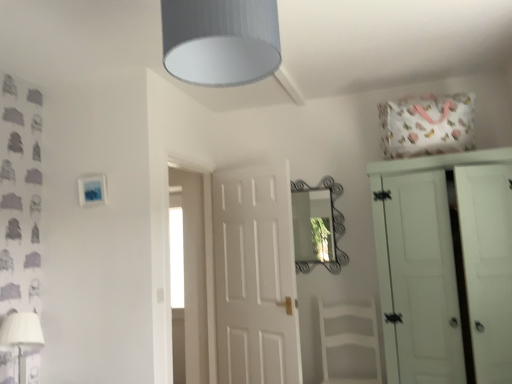
Question: Is white fabric lampshade at lower left a part of white painted wood wardrobe at right?

Choices:
 (A) no
 (B) yes

Answer: (A)

Question: From a real-world perspective, is white painted wood wardrobe at right located higher than white fabric lampshade at lower left?

Choices:
 (A) no
 (B) yes

Answer: (B)

Question: Can you confirm if white painted wood wardrobe at right is taller than white fabric lampshade at lower left?

Choices:
 (A) yes
 (B) no

Answer: (A)

Question: Considering the relative sizes of white painted wood wardrobe at right and white fabric lampshade at lower left in the image provided, is white painted wood wardrobe at right thinner than white fabric lampshade at lower left?

Choices:
 (A) no
 (B) yes

Answer: (A)

Question: Can you confirm if white painted wood wardrobe at right is smaller than white fabric lampshade at lower left?

Choices:
 (A) yes
 (B) no

Answer: (B)

Question: From a real-world perspective, is white painted wood wardrobe at right beneath white fabric lampshade at lower left?

Choices:
 (A) no
 (B) yes

Answer: (A)

Question: Is white painted wood wardrobe at right outside of white wood armchair at center?

Choices:
 (A) no
 (B) yes

Answer: (B)

Question: Is white painted wood wardrobe at right taller than white wood armchair at center?

Choices:
 (A) yes
 (B) no

Answer: (A)

Question: Is white painted wood wardrobe at right in contact with white wood armchair at center?

Choices:
 (A) yes
 (B) no

Answer: (B)

Question: Is white painted wood wardrobe at right behind white wood armchair at center?

Choices:
 (A) yes
 (B) no

Answer: (B)

Question: Can you confirm if white painted wood wardrobe at right is wider than white wood armchair at center?

Choices:
 (A) yes
 (B) no

Answer: (A)

Question: Considering the relative sizes of white painted wood wardrobe at right and white wood armchair at center in the image provided, is white painted wood wardrobe at right thinner than white wood armchair at center?

Choices:
 (A) no
 (B) yes

Answer: (A)

Question: Can you confirm if white painted wood wardrobe at right is shorter than gray textured lampshade at upper center?

Choices:
 (A) no
 (B) yes

Answer: (A)